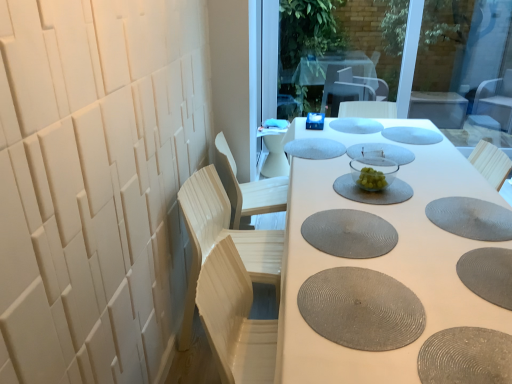
Where is `vacant space underneath blue fabric cushion at center, the first manhole cover in the back-to-front sequence (from a real-world perspective)`? Image resolution: width=512 pixels, height=384 pixels. vacant space underneath blue fabric cushion at center, the first manhole cover in the back-to-front sequence (from a real-world perspective) is located at coordinates (350, 123).